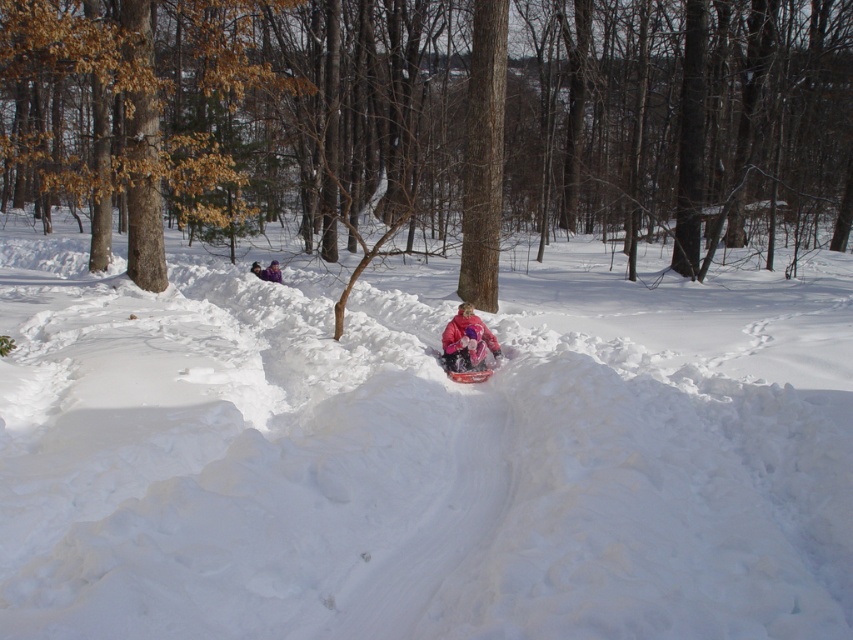
Question: Which of the following is the closest to the observer?

Choices:
 (A) pink fleece jacket at center
 (B) brown rough tree at center
 (C) white fluffy snow at center

Answer: (C)

Question: Does white fluffy snow at center appear over pink fleece jacket at center?

Choices:
 (A) yes
 (B) no

Answer: (A)

Question: Based on their relative distances, which object is nearer to the brown rough tree at center?

Choices:
 (A) white fluffy snow at center
 (B) pink fleece jacket at center

Answer: (A)

Question: Which point is farther to the camera?

Choices:
 (A) pink fleece jacket at center
 (B) brown rough tree at center

Answer: (B)

Question: Does white fluffy snow at center have a greater width compared to pink fleece jacket at center?

Choices:
 (A) no
 (B) yes

Answer: (B)

Question: Is brown rough tree at center further to the viewer compared to pink fleece jacket at center?

Choices:
 (A) yes
 (B) no

Answer: (A)